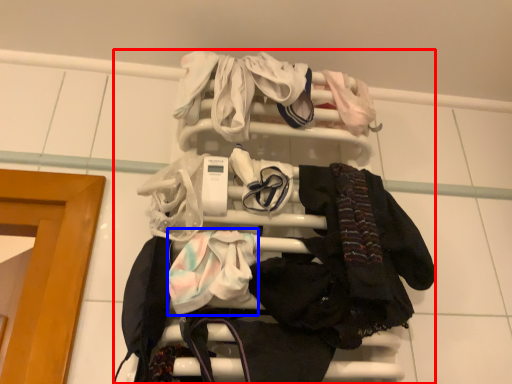
Question: Which object appears closest to the camera in this image, bunk bed (highlighted by a red box) or baby clothe (highlighted by a blue box)?

Choices:
 (A) bunk bed
 (B) baby clothe

Answer: (B)